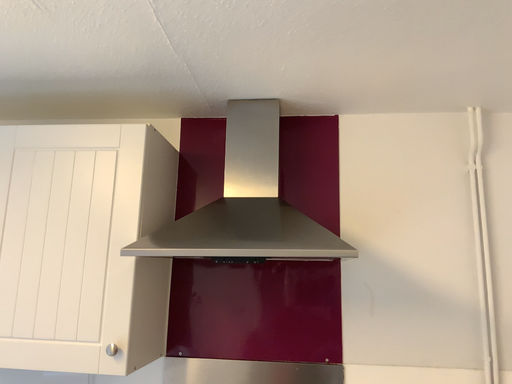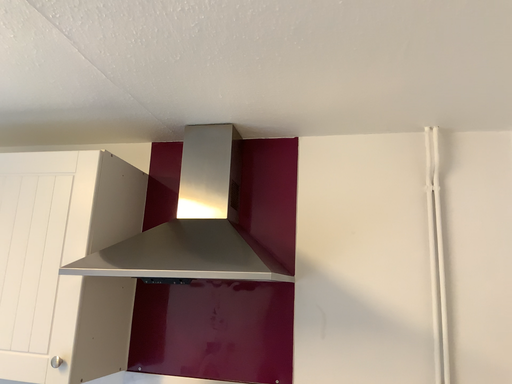
Question: How did the camera likely rotate when shooting the video?

Choices:
 (A) rotated left
 (B) rotated right

Answer: (A)